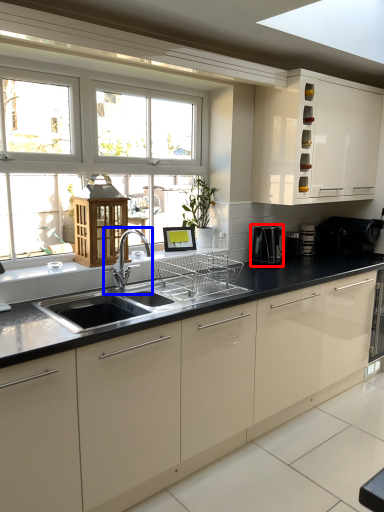
Question: Which point is further to the camera, coffee machine (highlighted by a red box) or tap (highlighted by a blue box)?

Choices:
 (A) coffee machine
 (B) tap

Answer: (A)